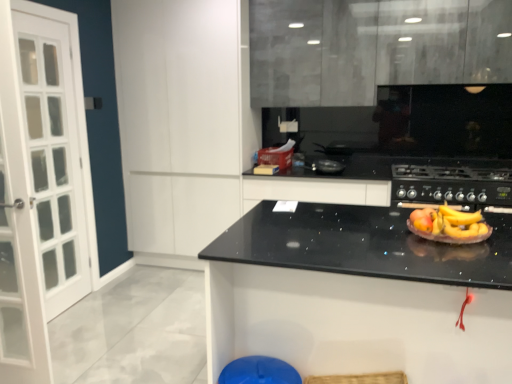
At what (x,y) coordinates should I click in order to perform the action: click on white matte cabinet at upper left, which is the first cabinetry in left-to-right order. Please return your answer as a coordinate pair (x, y). Image resolution: width=512 pixels, height=384 pixels. Looking at the image, I should click on (183, 123).

This screenshot has width=512, height=384. Describe the element at coordinates (259, 371) in the screenshot. I see `blue plastic bar stool at lower center` at that location.

Measure the distance between point (x=261, y=369) and camera.

Point (x=261, y=369) is 1.72 meters away from camera.

The width and height of the screenshot is (512, 384). What do you see at coordinates (452, 184) in the screenshot? I see `black matte gas stove at center` at bounding box center [452, 184].

Locate an element on the screen. The height and width of the screenshot is (384, 512). black granite countertop at center is located at coordinates (359, 295).

Image resolution: width=512 pixels, height=384 pixels. Describe the element at coordinates (448, 236) in the screenshot. I see `matte black paper plate at center` at that location.

This screenshot has height=384, width=512. Identify the location of white matte cabinet at upper left, which is the first cabinetry in left-to-right order. (183, 123).

Is blue plastic bar stool at lower center at the back of black matte gas stove at center?

That's not correct — black matte gas stove at center is not looking away from blue plastic bar stool at lower center.

Which object is thinner, black matte gas stove at center or blue plastic bar stool at lower center?

blue plastic bar stool at lower center is thinner.

Can blue plastic bar stool at lower center be found inside black matte gas stove at center?

Actually, blue plastic bar stool at lower center is outside black matte gas stove at center.

Is black matte gas stove at center positioned far away from blue plastic bar stool at lower center?

black matte gas stove at center is positioned a significant distance from blue plastic bar stool at lower center.

Are white matte cabinet at upper left, which is counted as the second cabinetry, starting from the right, and matte gray cabinets at upper center, the second cabinetry from the left, far apart?

That's not correct — white matte cabinet at upper left, which is counted as the second cabinetry, starting from the right, is a little close to matte gray cabinets at upper center, the second cabinetry from the left.

How different are the orientations of white matte cabinet at upper left, which is counted as the second cabinetry, starting from the right, and matte gray cabinets at upper center, the second cabinetry from the left, in degrees?

The angular difference between white matte cabinet at upper left, which is counted as the second cabinetry, starting from the right, and matte gray cabinets at upper center, the second cabinetry from the left, is 0.456 degrees.

Considering the sizes of objects white matte cabinet at upper left, which is the first cabinetry in left-to-right order, and matte gray cabinets at upper center, which appears as the 1th cabinetry when viewed from the right, in the image provided, who is taller, white matte cabinet at upper left, which is the first cabinetry in left-to-right order, or matte gray cabinets at upper center, which appears as the 1th cabinetry when viewed from the right,?

With more height is white matte cabinet at upper left, which is the first cabinetry in left-to-right order.

From the image's perspective, which is above, white matte cabinet at upper left, which is counted as the second cabinetry, starting from the right, or matte gray cabinets at upper center, the second cabinetry from the left?

matte gray cabinets at upper center, the second cabinetry from the left, from the image's perspective.

From the image's perspective, is blue plastic bar stool at lower center on top of matte gray cabinets at upper center, which appears as the 1th cabinetry when viewed from the right?

No, from the image's perspective, blue plastic bar stool at lower center is not on top of matte gray cabinets at upper center, which appears as the 1th cabinetry when viewed from the right.

From their relative heights in the image, would you say blue plastic bar stool at lower center is taller or shorter than matte gray cabinets at upper center, the second cabinetry from the left?

In the image, blue plastic bar stool at lower center appears to be shorter than matte gray cabinets at upper center, the second cabinetry from the left.

Is blue plastic bar stool at lower center turned away from matte gray cabinets at upper center, which appears as the 1th cabinetry when viewed from the right?

No, blue plastic bar stool at lower center is not facing away from matte gray cabinets at upper center, which appears as the 1th cabinetry when viewed from the right.

Identify the location of bar stool directly beneath the matte gray cabinets at upper center, the second cabinetry from the left (from a real-world perspective). (259, 371).

Considering the sizes of black matte gas stove at center and white matte cabinet at upper left, which is counted as the second cabinetry, starting from the right, in the image, is black matte gas stove at center taller or shorter than white matte cabinet at upper left, which is counted as the second cabinetry, starting from the right,?

In the image, black matte gas stove at center appears to be shorter than white matte cabinet at upper left, which is counted as the second cabinetry, starting from the right.

There is a black matte gas stove at center. At what (x,y) coordinates should I click in order to perform the action: click on the 1st cabinetry above it (from a real-world perspective). Please return your answer as a coordinate pair (x, y). The width and height of the screenshot is (512, 384). Looking at the image, I should click on (183, 123).

Considering the positions of point (400, 184) and point (187, 68), is point (400, 184) closer or farther from the camera than point (187, 68)?

Point (400, 184).

From the image's perspective, would you say black matte gas stove at center is positioned over white matte cabinet at upper left, which is counted as the second cabinetry, starting from the right?

No, from the image's perspective, black matte gas stove at center is not on top of white matte cabinet at upper left, which is counted as the second cabinetry, starting from the right.

How many degrees apart are the facing directions of matte black paper plate at center and matte gray cabinets at upper center, the second cabinetry from the left?

They differ by 3.3 degrees in their facing directions.

Based on the photo, which of these two, matte black paper plate at center or matte gray cabinets at upper center, the second cabinetry from the left, stands shorter?

matte black paper plate at center.

Could you tell me if matte black paper plate at center is turned towards matte gray cabinets at upper center, which appears as the 1th cabinetry when viewed from the right?

No, matte black paper plate at center is not turned towards matte gray cabinets at upper center, which appears as the 1th cabinetry when viewed from the right.

From the image's perspective, is matte black paper plate at center on top of matte gray cabinets at upper center, the second cabinetry from the left?

Incorrect, from the image's perspective, matte black paper plate at center is lower than matte gray cabinets at upper center, the second cabinetry from the left.

Based on the photo, between blue plastic bar stool at lower center and matte black paper plate at center, which one is positioned in front?

Positioned in front is blue plastic bar stool at lower center.

Could you tell me if blue plastic bar stool at lower center is facing matte black paper plate at center?

No, blue plastic bar stool at lower center does not turn towards matte black paper plate at center.

Is blue plastic bar stool at lower center at the left side of matte black paper plate at center?

Yes.

Is the position of black granite countertop at center less distant than that of matte black paper plate at center?

Yes, the depth of black granite countertop at center is less than that of matte black paper plate at center.

Is the surface of black granite countertop at center in direct contact with matte black paper plate at center?

No, black granite countertop at center is not making contact with matte black paper plate at center.

Which of these two, black granite countertop at center or matte black paper plate at center, is bigger?

black granite countertop at center is bigger.

Where is `bar stool on the left of the black matte gas stove at center`? bar stool on the left of the black matte gas stove at center is located at coordinates (259, 371).

Where is `cabinetry that is on the right side of white matte cabinet at upper left, which is the first cabinetry in left-to-right order`? The image size is (512, 384). cabinetry that is on the right side of white matte cabinet at upper left, which is the first cabinetry in left-to-right order is located at coordinates (373, 47).

Considering their positions, is blue plastic bar stool at lower center positioned closer to black matte gas stove at center than white matte cabinet at upper left, which is the first cabinetry in left-to-right order?

Based on the image, white matte cabinet at upper left, which is the first cabinetry in left-to-right order, appears to be nearer to black matte gas stove at center.

Looking at the image, which one is located closer to matte gray cabinets at upper center, which appears as the 1th cabinetry when viewed from the right, matte black paper plate at center or black matte gas stove at center?

Among the two, black matte gas stove at center is located nearer to matte gray cabinets at upper center, which appears as the 1th cabinetry when viewed from the right.

Based on their spatial positions, is matte gray cabinets at upper center, which appears as the 1th cabinetry when viewed from the right, or black granite countertop at center closer to black matte gas stove at center?

matte gray cabinets at upper center, which appears as the 1th cabinetry when viewed from the right, is positioned closer to the anchor black matte gas stove at center.

From the image, which object appears to be farther from white matte cabinet at upper left, which is counted as the second cabinetry, starting from the right, black granite countertop at center or blue plastic bar stool at lower center?

blue plastic bar stool at lower center lies further to white matte cabinet at upper left, which is counted as the second cabinetry, starting from the right, than the other object.

Looking at the image, which one is located further to blue plastic bar stool at lower center, matte black paper plate at center or matte gray cabinets at upper center, the second cabinetry from the left?

matte gray cabinets at upper center, the second cabinetry from the left, is further to blue plastic bar stool at lower center.

From the image, which object appears to be nearer to white matte cabinet at upper left, which is counted as the second cabinetry, starting from the right, black granite countertop at center or matte black paper plate at center?

The object closer to white matte cabinet at upper left, which is counted as the second cabinetry, starting from the right, is black granite countertop at center.

When comparing their distances from matte black paper plate at center, does black matte gas stove at center or blue plastic bar stool at lower center seem closer?

→ blue plastic bar stool at lower center lies closer to matte black paper plate at center than the other object.

From the picture: Based on their spatial positions, is white matte cabinet at upper left, which is the first cabinetry in left-to-right order, or matte gray cabinets at upper center, the second cabinetry from the left, further from blue plastic bar stool at lower center?

matte gray cabinets at upper center, the second cabinetry from the left, is positioned further to the anchor blue plastic bar stool at lower center.

Find the location of `paper plate between white matte cabinet at upper left, which is counted as the second cabinetry, starting from the right, and matte gray cabinets at upper center, which appears as the 1th cabinetry when viewed from the right`. paper plate between white matte cabinet at upper left, which is counted as the second cabinetry, starting from the right, and matte gray cabinets at upper center, which appears as the 1th cabinetry when viewed from the right is located at coordinates [x=448, y=236].

Image resolution: width=512 pixels, height=384 pixels. What are the coordinates of `bar stool between black granite countertop at center and black matte gas stove at center from front to back` in the screenshot? It's located at (259, 371).

Where is `paper plate between white matte cabinet at upper left, which is the first cabinetry in left-to-right order, and black matte gas stove at center, in the horizontal direction`? Image resolution: width=512 pixels, height=384 pixels. paper plate between white matte cabinet at upper left, which is the first cabinetry in left-to-right order, and black matte gas stove at center, in the horizontal direction is located at coordinates (448, 236).

The height and width of the screenshot is (384, 512). What are the coordinates of `gas stove positioned between matte black paper plate at center and matte gray cabinets at upper center, which appears as the 1th cabinetry when viewed from the right, from near to far` in the screenshot? It's located at (452, 184).